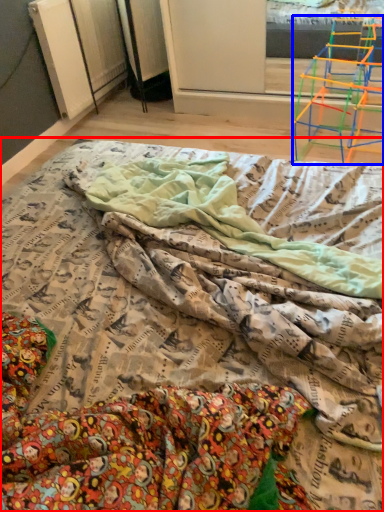
Question: Which point is closer to the camera, bed (highlighted by a red box) or furniture (highlighted by a blue box)?

Choices:
 (A) bed
 (B) furniture

Answer: (A)